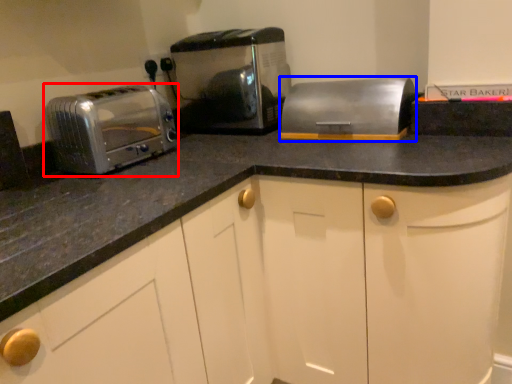
Question: Which point is further to the camera, toaster (highlighted by a red box) or appliance (highlighted by a blue box)?

Choices:
 (A) toaster
 (B) appliance

Answer: (B)